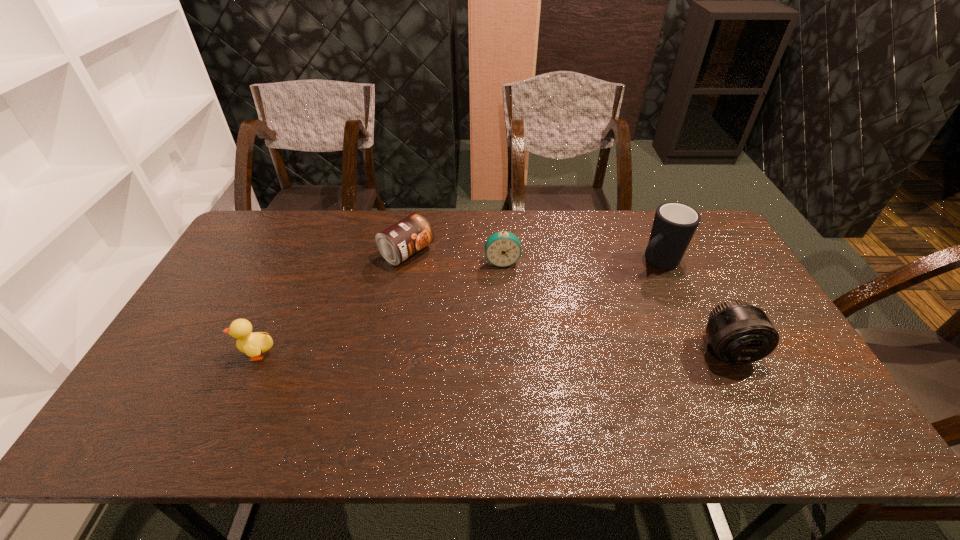
At what (x,y) coordinates should I click in order to perform the action: click on duckling. Please return your answer as a coordinate pair (x, y). This screenshot has width=960, height=540. Looking at the image, I should click on (254, 344).

Identify the location of the fourth shortest object. (739, 333).

Locate an element on the screen. The width and height of the screenshot is (960, 540). alarm clock is located at coordinates (502, 249).

The width and height of the screenshot is (960, 540). Identify the location of the tallest object. click(674, 225).

Find the location of a particular element. The height and width of the screenshot is (540, 960). can is located at coordinates (408, 236).

You are a GUI agent. You are given a task and a screenshot of the screen. Output one action in this format:
    pyautogui.click(x=<x>, y=<y>)
    Task: Click on the vacant space located on the front-facing side of the duckling
    The height and width of the screenshot is (540, 960).
    Given the screenshot: What is the action you would take?
    pyautogui.click(x=164, y=354)

This screenshot has height=540, width=960. I want to click on vacant area situated on the front-facing side of the telephoto lens, so click(751, 394).

Identify the location of free point located on the front-facing side of the third object from right to left. The image size is (960, 540). (506, 291).

At what (x,y) coordinates should I click in order to perform the action: click on vacant space located 0.300m on the front-facing side of the third object from right to left. Please return your answer as a coordinate pair (x, y). Looking at the image, I should click on (513, 343).

I want to click on free spot located on the front-facing side of the third object from right to left, so click(507, 301).